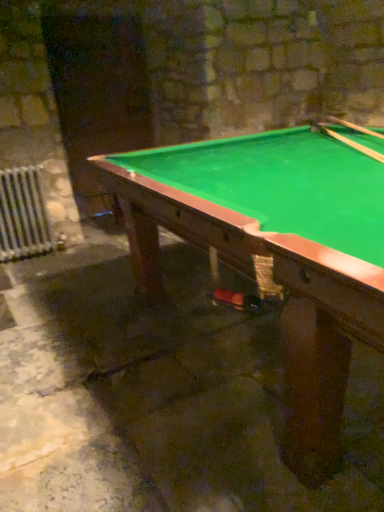
Question: Could wooden cue at upper right, the 2th cue when ordered from right to left, be considered to be inside green felt pool table at center?

Choices:
 (A) no
 (B) yes

Answer: (B)

Question: Is green felt pool table at center positioned beyond the bounds of wooden cue at upper right, arranged as the 1th cue when viewed from the left?

Choices:
 (A) yes
 (B) no

Answer: (A)

Question: Is green felt pool table at center wider than wooden cue at upper right, arranged as the 1th cue when viewed from the left?

Choices:
 (A) yes
 (B) no

Answer: (A)

Question: Considering the relative positions of green felt pool table at center and wooden cue at upper right, the 2th cue when ordered from right to left, in the image provided, is green felt pool table at center to the left of wooden cue at upper right, the 2th cue when ordered from right to left, from the viewer's perspective?

Choices:
 (A) no
 (B) yes

Answer: (B)

Question: Considering the relative sizes of green felt pool table at center and wooden cue at upper right, the 2th cue when ordered from right to left, in the image provided, is green felt pool table at center smaller than wooden cue at upper right, the 2th cue when ordered from right to left,?

Choices:
 (A) no
 (B) yes

Answer: (A)

Question: Is green felt pool table at center looking in the opposite direction of wooden cue at upper right, arranged as the 1th cue when viewed from the left?

Choices:
 (A) yes
 (B) no

Answer: (B)

Question: Is white metal radiator at lower left closer to camera compared to wooden smooth cue at upper right, the 2th cue viewed from the left?

Choices:
 (A) no
 (B) yes

Answer: (A)

Question: Considering the relative sizes of white metal radiator at lower left and wooden smooth cue at upper right, placed as the first cue when sorted from right to left, in the image provided, is white metal radiator at lower left taller than wooden smooth cue at upper right, placed as the first cue when sorted from right to left,?

Choices:
 (A) yes
 (B) no

Answer: (A)

Question: From the image's perspective, is white metal radiator at lower left on wooden smooth cue at upper right, placed as the first cue when sorted from right to left?

Choices:
 (A) no
 (B) yes

Answer: (A)

Question: Can you confirm if white metal radiator at lower left is positioned to the right of wooden smooth cue at upper right, the 2th cue viewed from the left?

Choices:
 (A) no
 (B) yes

Answer: (A)

Question: Is white metal radiator at lower left shorter than wooden smooth cue at upper right, the 2th cue viewed from the left?

Choices:
 (A) no
 (B) yes

Answer: (A)

Question: Is white metal radiator at lower left at the left side of wooden smooth cue at upper right, placed as the first cue when sorted from right to left?

Choices:
 (A) yes
 (B) no

Answer: (A)

Question: Considering the relative sizes of green felt pool table at center and white metal radiator at lower left in the image provided, is green felt pool table at center taller than white metal radiator at lower left?

Choices:
 (A) yes
 (B) no

Answer: (A)